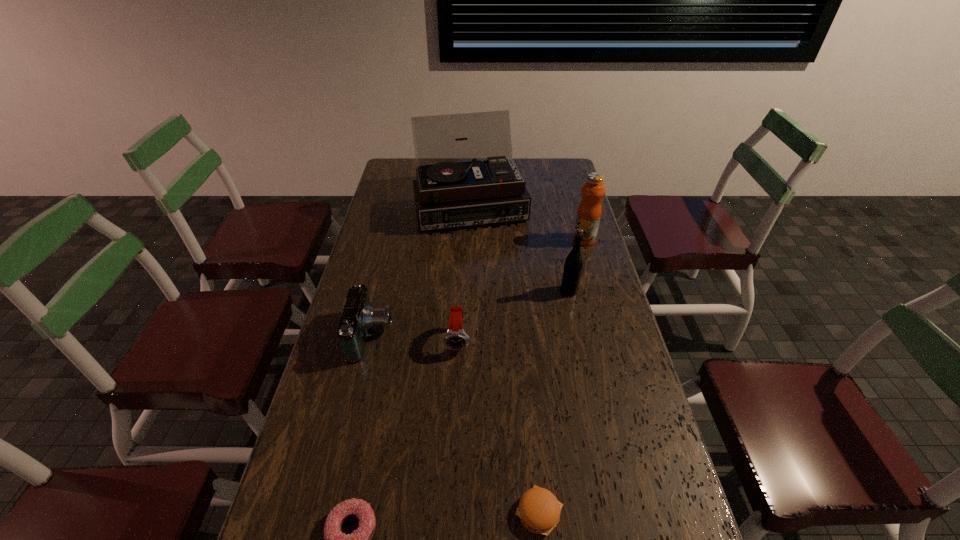
Locate an element on the screen. free space located 0.190m on the front-facing side of the camcorder is located at coordinates (456, 335).

Find the location of a particular element. This screenshot has width=960, height=540. vacant space located on the face of the watch is located at coordinates (455, 412).

In order to click on vacant space situated 0.170m on the left of the patty in this screenshot , I will do `click(437, 512)`.

You are a GUI agent. You are given a task and a screenshot of the screen. Output one action in this format:
    pyautogui.click(x=<x>, y=<y>)
    Task: Click on the object that is at the far edge
    The width and height of the screenshot is (960, 540).
    Given the screenshot: What is the action you would take?
    pyautogui.click(x=454, y=189)

You are a GUI agent. You are given a task and a screenshot of the screen. Output one action in this format:
    pyautogui.click(x=<x>, y=<y>)
    Task: Click on the record player that is positioned at the left edge
    Image resolution: width=960 pixels, height=540 pixels.
    Given the screenshot: What is the action you would take?
    pyautogui.click(x=454, y=189)

Find the location of a particular element. camcorder that is at the left edge is located at coordinates (359, 316).

Image resolution: width=960 pixels, height=540 pixels. Find the location of `fruit juice that is positioned at the right edge`. fruit juice that is positioned at the right edge is located at coordinates (589, 211).

Where is `beer bottle present at the right edge`? This screenshot has width=960, height=540. beer bottle present at the right edge is located at coordinates 573,266.

Image resolution: width=960 pixels, height=540 pixels. What are the coordinates of `object that is at the far left corner` in the screenshot? It's located at (454, 189).

Where is `free spot at the left edge of the desktop`? Image resolution: width=960 pixels, height=540 pixels. free spot at the left edge of the desktop is located at coordinates (341, 454).